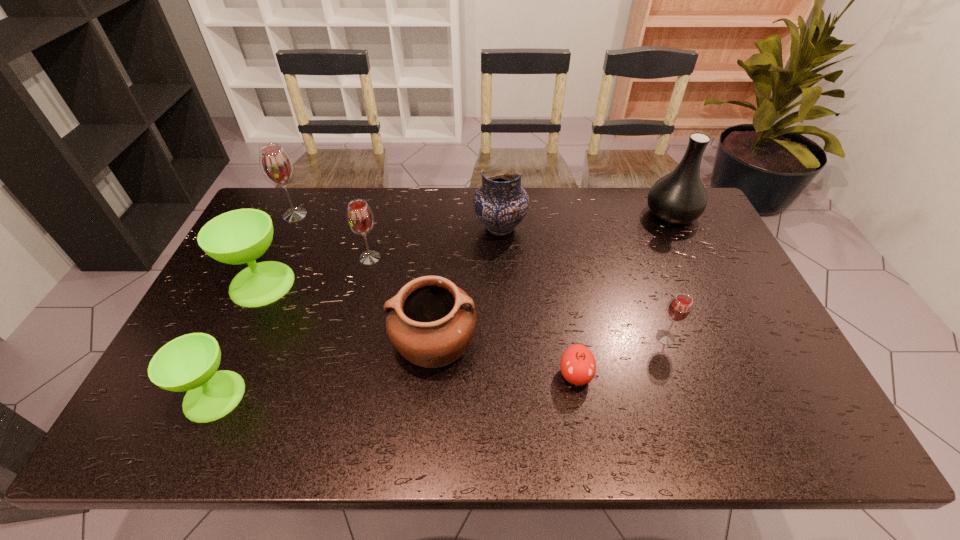
Find the location of a particular element. The image size is (960, 540). red wineglass that stands as the second closest to the leftmost red wineglass is located at coordinates (679, 309).

At what (x,y) coordinates should I click in order to perform the action: click on vacant space that satisfies the following two spatial constraints: 1. on the back side of the rightmost object; 2. on the left side of the taller pottery. Please return your answer as a coordinate pair (x, y). The width and height of the screenshot is (960, 540). Looking at the image, I should click on (499, 214).

Identify the location of vacant space that satisfies the following two spatial constraints: 1. on the front side of the biggest red wineglass; 2. on the left side of the rightmost red wineglass. The width and height of the screenshot is (960, 540). (237, 338).